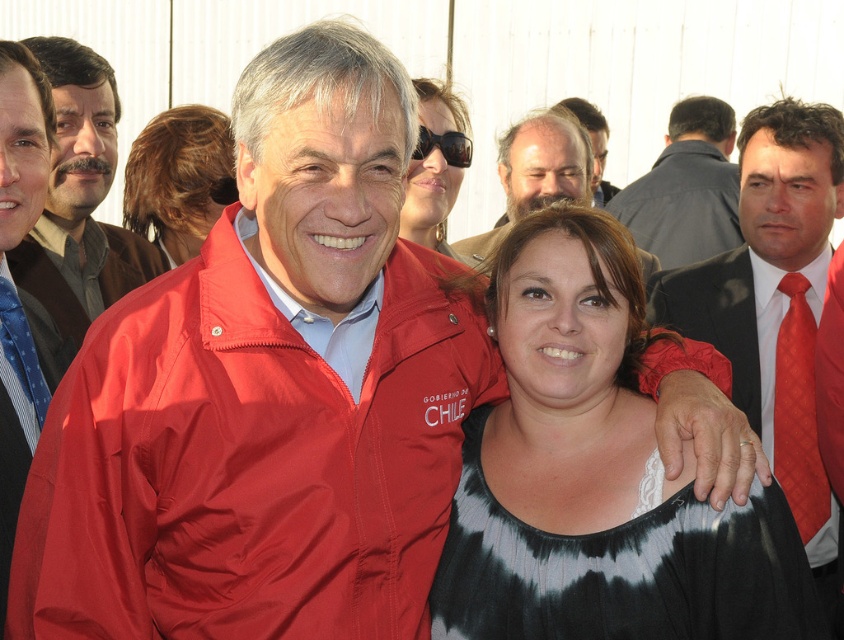
Looking at the scene, where is the red textured tie at right in relation to the bearded man at center?

The red textured tie at right is located to the right of the bearded man at center.